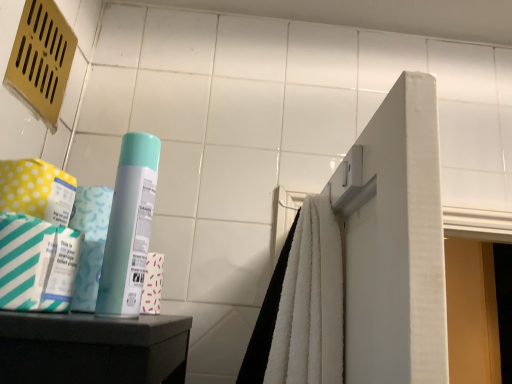
Locate an element on the screen. teal matte spray can at left is located at coordinates (129, 227).

Describe the element at coordinates (129, 227) in the screenshot. I see `teal matte spray can at left` at that location.

The width and height of the screenshot is (512, 384). Find the location of `teal matte spray can at left`. teal matte spray can at left is located at coordinates (129, 227).